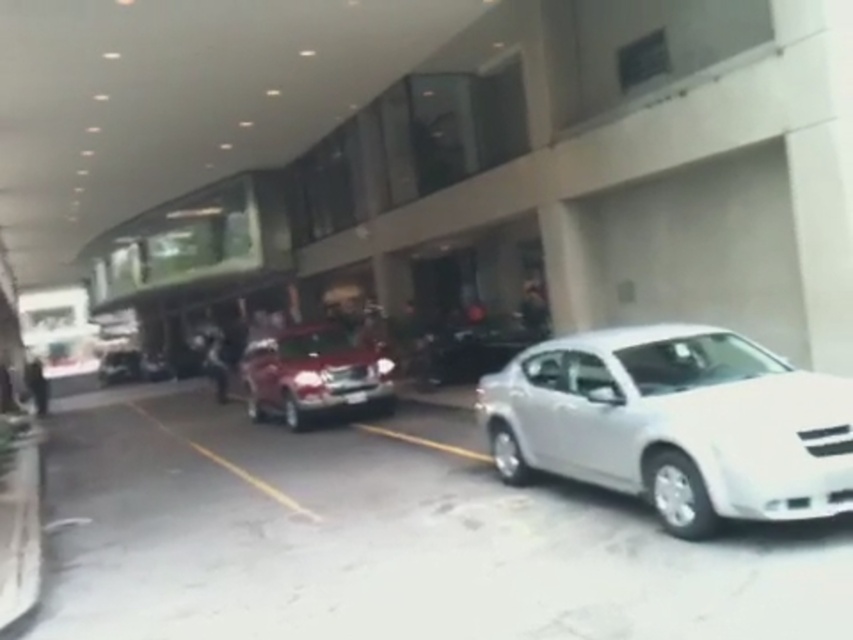
Is shiny red car at center bigger than shiny silver sedan at center?

Indeed, shiny red car at center has a larger size compared to shiny silver sedan at center.

Consider the image. Can you confirm if shiny red car at center is positioned to the left of shiny silver sedan at center?

Yes, shiny red car at center is to the left of shiny silver sedan at center.

The image size is (853, 640). Describe the element at coordinates (312, 372) in the screenshot. I see `shiny red car at center` at that location.

You are a GUI agent. You are given a task and a screenshot of the screen. Output one action in this format:
    pyautogui.click(x=<x>, y=<y>)
    Task: Click on the shiny red car at center
    This screenshot has width=853, height=640.
    Given the screenshot: What is the action you would take?
    pyautogui.click(x=312, y=372)

What do you see at coordinates (675, 422) in the screenshot? This screenshot has width=853, height=640. I see `white glossy sedan at center` at bounding box center [675, 422].

Is point (727, 397) in front of point (286, 381)?

Yes, point (727, 397) is in front of point (286, 381).

Which is in front, point (648, 433) or point (364, 387)?

Point (648, 433)

You are a GUI agent. You are given a task and a screenshot of the screen. Output one action in this format:
    pyautogui.click(x=<x>, y=<y>)
    Task: Click on the white glossy sedan at center
    The width and height of the screenshot is (853, 640).
    Given the screenshot: What is the action you would take?
    pyautogui.click(x=675, y=422)

Find the location of `white glossy sedan at center`. white glossy sedan at center is located at coordinates (675, 422).

Based on the photo, who is taller, white glossy sedan at center or shiny silver sedan at center?

Standing taller between the two is shiny silver sedan at center.

Measure the distance between white glossy sedan at center and camera.

A distance of 12.20 feet exists between white glossy sedan at center and camera.

Locate an element on the screen. white glossy sedan at center is located at coordinates (675, 422).